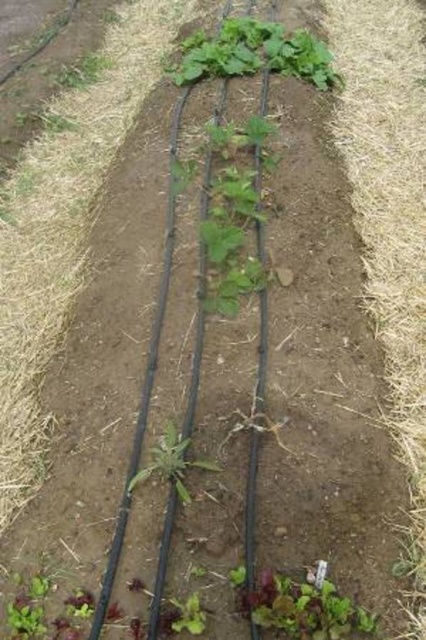
You are a gardener who wants to check the height of the brown straw at right and the green leafy lettuce at lower center. Which one is taller?

The brown straw at right is much taller than the green leafy lettuce at lower center.